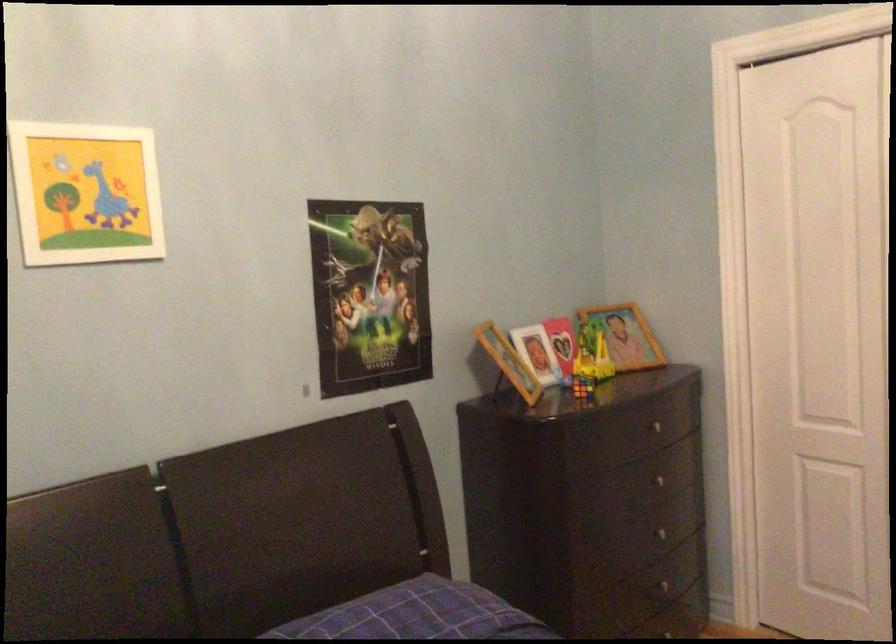
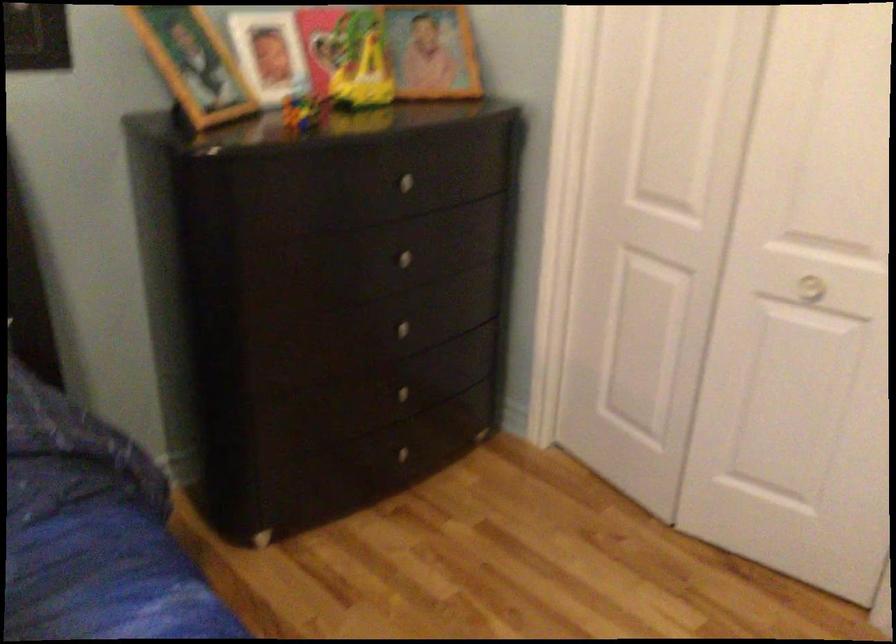
The point at [668,541] is marked in the first image. Where is the corresponding point in the second image?

(409, 332)